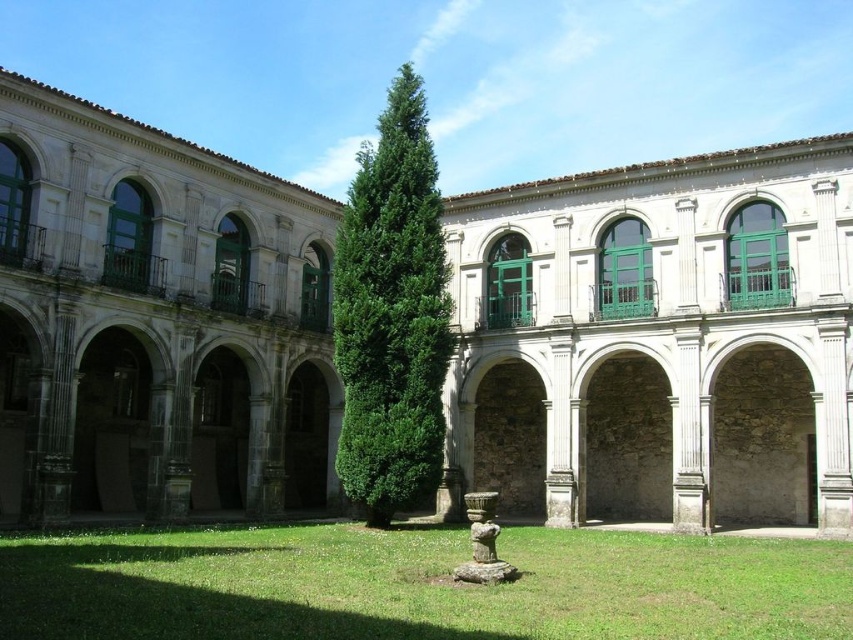
You are standing in the courtyard and want to take a photo of the stone arches at center. Where should you position yourself to capture them in the frame?

The stone arches at center are located at point (657, 340), so you should position yourself in the central area of the courtyard to capture them in the frame.

You are an architect analyzing the courtyard layout. You need to determine the relative sizes of the stone arches at center and the green leafy tree at center. Which object is larger?

The green leafy tree at center is larger than the stone arches at center.

You are a landscape architect planning to install a new pathway between the stone arches at center and the green grass at center. The pathway requires a minimum of 15 meters of space. Can you confirm if there is enough space between them to accommodate the pathway?

The distance between the stone arches at center and the green grass at center is 15.72 meters, which exceeds the required 15 meters. Therefore, there is sufficient space to install the pathway between them.